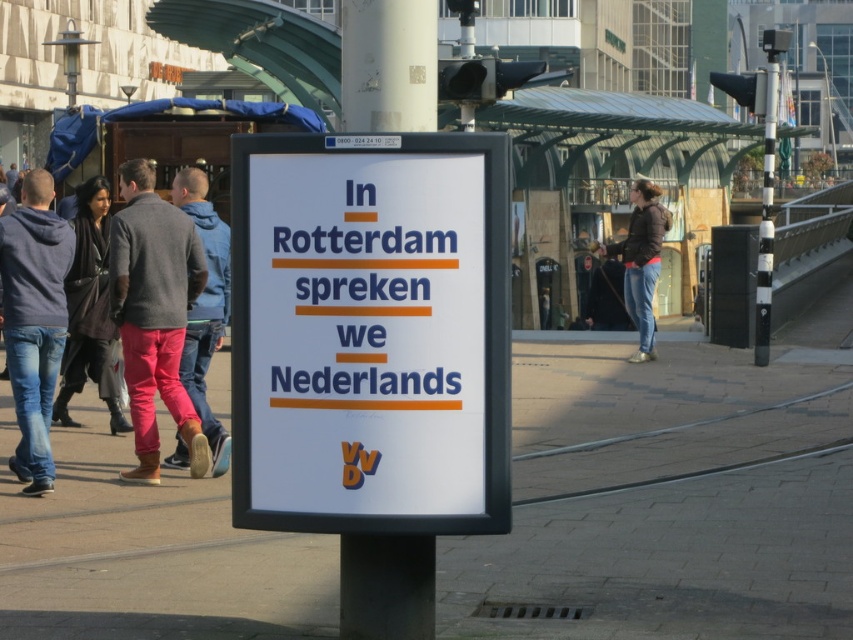
Question: Is white concrete pavement at center above black leather jacket at left?

Choices:
 (A) yes
 (B) no

Answer: (B)

Question: Can you confirm if black and white striped pole at right is bigger than white plastic street sign at upper center?

Choices:
 (A) no
 (B) yes

Answer: (B)

Question: Which point is farther to the camera?

Choices:
 (A) matte pink pants at left
 (B) denim jeans at left

Answer: (A)

Question: Is matte pink pants at left bigger than pink fabric pants at left?

Choices:
 (A) yes
 (B) no

Answer: (A)

Question: Which point is closer to the camera?

Choices:
 (A) matte pink pants at left
 (B) white plastic street sign at upper center
 (C) pink fabric pants at left
 (D) white concrete pavement at center

Answer: (D)

Question: Which point is farther to the camera?

Choices:
 (A) (184, 444)
 (B) (47, 477)
 (C) (621, 268)
 (D) (390, 358)

Answer: (C)